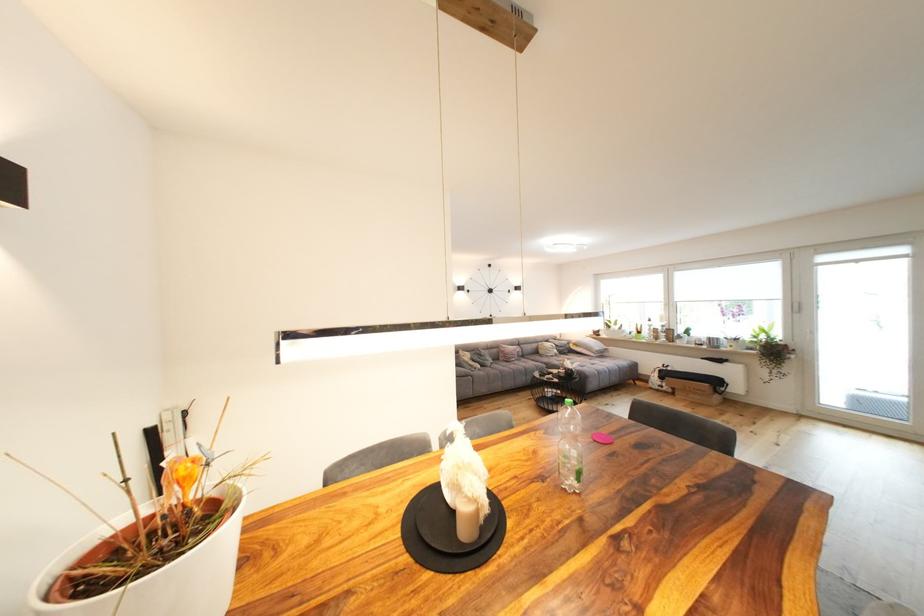
Where would you lift the grey patterned pillow? Please return your answer as a coordinate pair (x, y).

(561, 345)